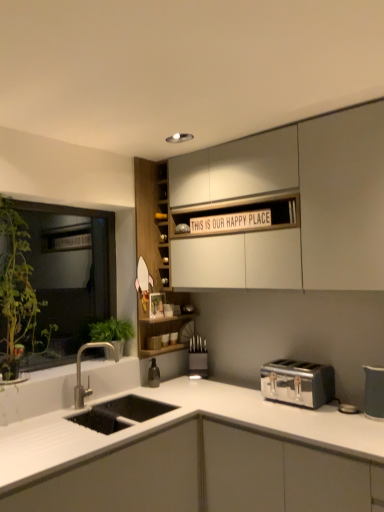
You are a GUI agent. You are given a task and a screenshot of the screen. Output one action in this format:
    pyautogui.click(x=<x>, y=<y>)
    Task: Click on the free space in front of satin nickel faucet at lower left
    
    Given the screenshot: What is the action you would take?
    pyautogui.click(x=93, y=424)